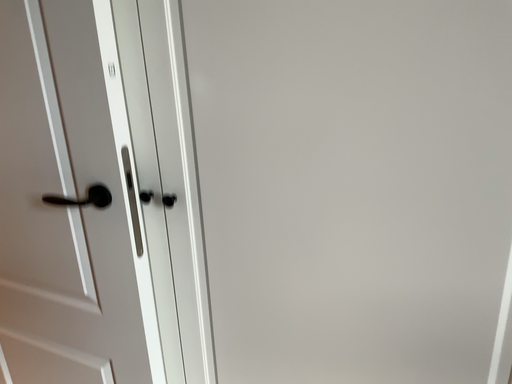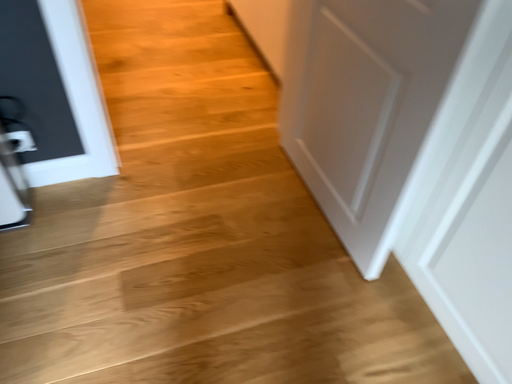
Question: Which way did the camera rotate in the video?

Choices:
 (A) rotated upward
 (B) rotated downward

Answer: (B)